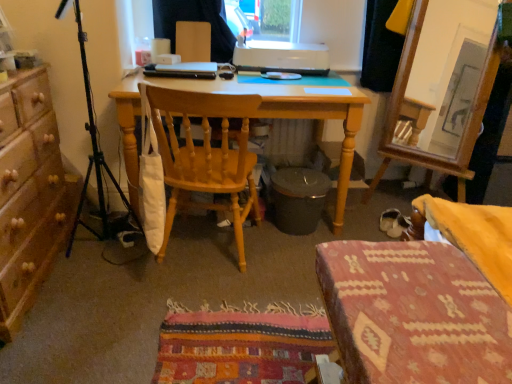
Locate an element on the screen. free space on the front side of light wood desk at center is located at coordinates (193, 311).